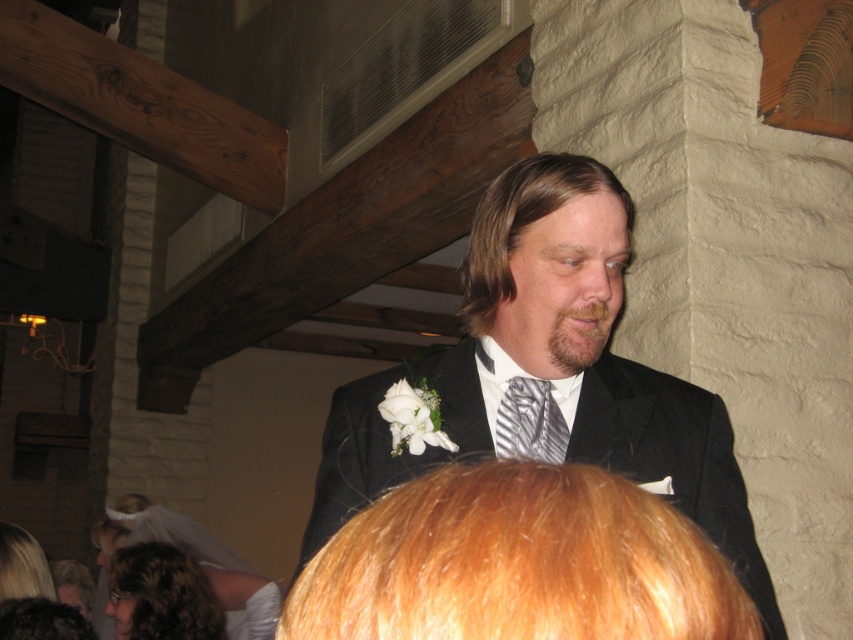
You are a photographer at the event and need to take a photo of the silver striped tie at center. Your camera is 1.31 meters away from the tie. Can you capture the entire tie in the frame without moving the camera?

The silver striped tie at center and camera are 1.31 meters apart. Since the distance between them is exactly 1.31 meters, you can adjust the camera settings such as zoom to ensure the entire tie fits in the frame without moving the camera.

You are at a wedding reception and notice a person wearing a silver striped tie at center and dark brown hair at lower left. Which item is closer to you?

The silver striped tie at center is closer to you because it is in front of the dark brown hair at lower left.